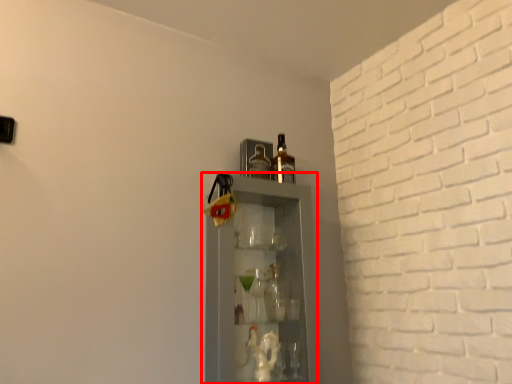
Question: In this image, where is shelf (annotated by the red box) located relative to bottle?

Choices:
 (A) right
 (B) left

Answer: (B)